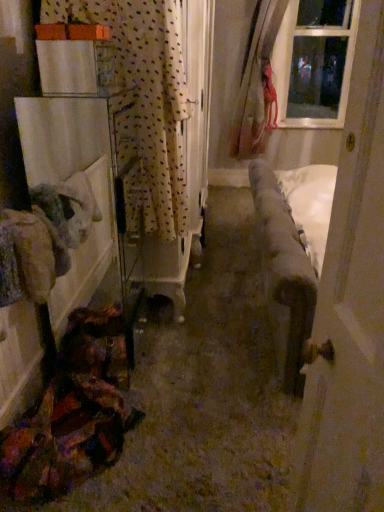
Question: Does velvet fabric couch at center lie behind wooden door at right?

Choices:
 (A) yes
 (B) no

Answer: (A)

Question: From the image's perspective, is velvet fabric couch at center beneath wooden door at right?

Choices:
 (A) no
 (B) yes

Answer: (A)

Question: Does velvet fabric couch at center have a larger size compared to wooden door at right?

Choices:
 (A) no
 (B) yes

Answer: (B)

Question: Is velvet fabric couch at center beside wooden door at right?

Choices:
 (A) yes
 (B) no

Answer: (B)

Question: Would you say velvet fabric couch at center is a long distance from wooden door at right?

Choices:
 (A) no
 (B) yes

Answer: (A)

Question: From a real-world perspective, is velvet fabric couch at center on top of wooden door at right?

Choices:
 (A) no
 (B) yes

Answer: (A)

Question: Does velvet fabric couch at center have a lesser width compared to clear glass window at upper right?

Choices:
 (A) no
 (B) yes

Answer: (A)

Question: From the image's perspective, is velvet fabric couch at center under clear glass window at upper right?

Choices:
 (A) no
 (B) yes

Answer: (B)

Question: From a real-world perspective, is velvet fabric couch at center beneath clear glass window at upper right?

Choices:
 (A) no
 (B) yes

Answer: (B)

Question: Is velvet fabric couch at center to the right of clear glass window at upper right from the viewer's perspective?

Choices:
 (A) no
 (B) yes

Answer: (A)

Question: Are velvet fabric couch at center and clear glass window at upper right far apart?

Choices:
 (A) yes
 (B) no

Answer: (A)

Question: Is velvet fabric couch at center placed right next to clear glass window at upper right?

Choices:
 (A) no
 (B) yes

Answer: (A)

Question: Is white polka dot fabric at left aimed at velvet fabric couch at center?

Choices:
 (A) yes
 (B) no

Answer: (B)